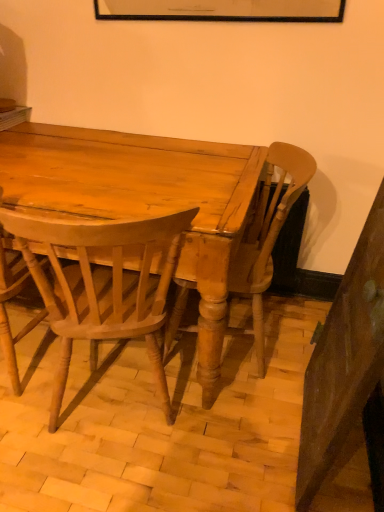
Question: Is light brown wood chair at center, the 3th chair in the right-to-left sequence, not within light brown wood chair at center, the 2th chair from the right?

Choices:
 (A) no
 (B) yes

Answer: (B)

Question: Is there a large distance between light brown wood chair at center, which ranks as the 1th chair in left-to-right order, and light brown wood chair at center, acting as the 2th chair starting from the left?

Choices:
 (A) yes
 (B) no

Answer: (B)

Question: Considering the relative sizes of light brown wood chair at center, the 3th chair in the right-to-left sequence, and light brown wood chair at center, the 2th chair from the right, in the image provided, is light brown wood chair at center, the 3th chair in the right-to-left sequence, taller than light brown wood chair at center, the 2th chair from the right,?

Choices:
 (A) no
 (B) yes

Answer: (B)

Question: Can you confirm if light brown wood chair at center, which ranks as the 1th chair in left-to-right order, is wider than light brown wood chair at center, acting as the 2th chair starting from the left?

Choices:
 (A) no
 (B) yes

Answer: (B)

Question: Is light brown wood chair at center, acting as the 2th chair starting from the left, located within light brown wood chair at center, the 3th chair in the right-to-left sequence?

Choices:
 (A) no
 (B) yes

Answer: (A)

Question: From the image's perspective, is light brown wood chair at center, the 3th chair in the right-to-left sequence, under light brown wood chair at center, the 2th chair from the right?

Choices:
 (A) no
 (B) yes

Answer: (A)

Question: Is light brown wood chair at center, the 2th chair from the right, to the left of light brown wood chair at center, marked as the third chair in a left-to-right arrangement, from the viewer's perspective?

Choices:
 (A) yes
 (B) no

Answer: (A)

Question: Is light brown wood chair at center, the 2th chair from the right, surrounding light brown wood chair at center, placed as the 1th chair when sorted from right to left?

Choices:
 (A) yes
 (B) no

Answer: (B)

Question: Considering the relative sizes of light brown wood chair at center, acting as the 2th chair starting from the left, and light brown wood chair at center, placed as the 1th chair when sorted from right to left, in the image provided, is light brown wood chair at center, acting as the 2th chair starting from the left, thinner than light brown wood chair at center, placed as the 1th chair when sorted from right to left,?

Choices:
 (A) yes
 (B) no

Answer: (B)

Question: From the image's perspective, is light brown wood chair at center, acting as the 2th chair starting from the left, on light brown wood chair at center, placed as the 1th chair when sorted from right to left?

Choices:
 (A) no
 (B) yes

Answer: (A)

Question: From a real-world perspective, is light brown wood chair at center, the 2th chair from the right, located beneath light brown wood chair at center, placed as the 1th chair when sorted from right to left?

Choices:
 (A) no
 (B) yes

Answer: (B)

Question: Is the position of light brown wood chair at center, the 2th chair from the right, more distant than that of light brown wood chair at center, marked as the third chair in a left-to-right arrangement?

Choices:
 (A) yes
 (B) no

Answer: (B)

Question: Is light brown wood chair at center, placed as the 1th chair when sorted from right to left, to the right of light brown wood chair at center, acting as the 2th chair starting from the left, from the viewer's perspective?

Choices:
 (A) yes
 (B) no

Answer: (A)